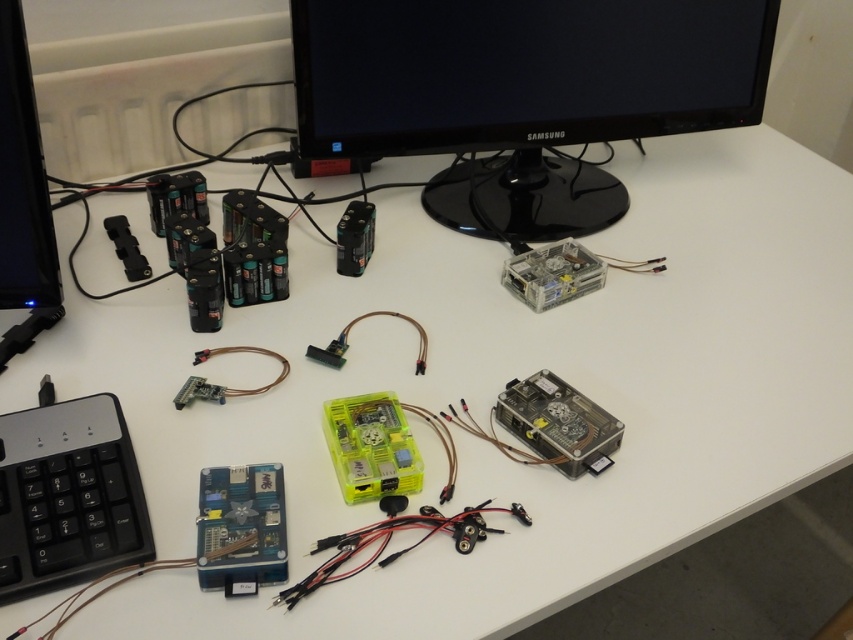
Question: In this image, where is black glossy monitor at upper center located relative to black plastic keyboard at lower left?

Choices:
 (A) right
 (B) left

Answer: (A)

Question: Which point is closer to the camera?

Choices:
 (A) blue plastic circuit board at lower left
 (B) black glossy monitor at upper center

Answer: (A)

Question: Which object is closer to the camera taking this photo?

Choices:
 (A) blue plastic circuit board at lower left
 (B) black plastic keyboard at lower left

Answer: (B)

Question: In this image, where is black glossy monitor at upper center located relative to black plastic keyboard at lower left?

Choices:
 (A) left
 (B) right

Answer: (B)

Question: Does black plastic keyboard at lower left have a lesser width compared to blue plastic circuit board at lower left?

Choices:
 (A) no
 (B) yes

Answer: (A)

Question: Considering the real-world distances, which object is farthest from the blue plastic circuit board at lower left?

Choices:
 (A) black glossy monitor at upper center
 (B) black plastic keyboard at lower left

Answer: (A)